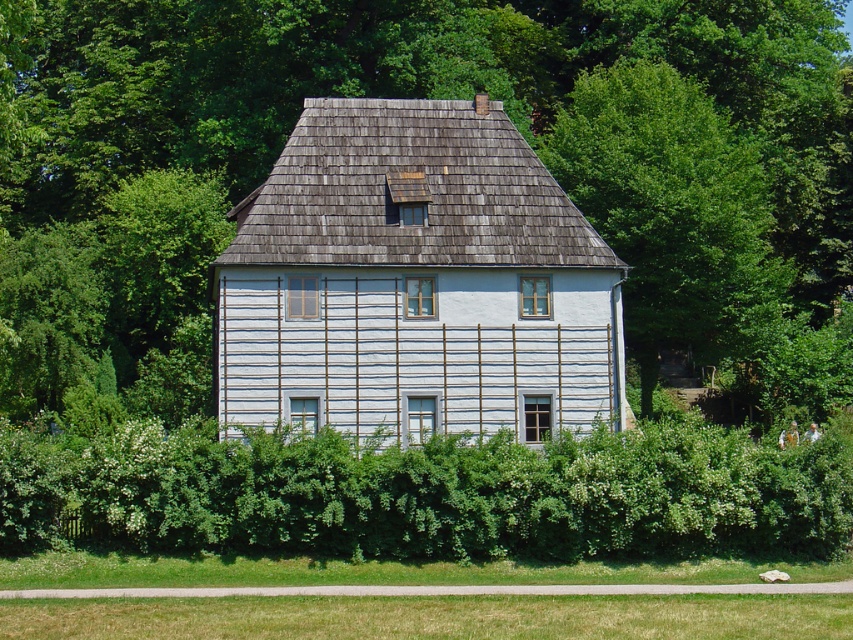
Question: Does green leafy tree at center appear on the right side of green leafy hedge at lower center?

Choices:
 (A) yes
 (B) no

Answer: (B)

Question: Among these objects, which one is farthest from the camera?

Choices:
 (A) green leafy tree at center
 (B) green leafy hedge at lower center

Answer: (B)

Question: Can you confirm if green leafy tree at center is positioned to the right of green leafy hedge at lower center?

Choices:
 (A) no
 (B) yes

Answer: (A)

Question: Among these objects, which one is farthest from the camera?

Choices:
 (A) green leafy tree at center
 (B) green leafy hedge at lower center

Answer: (B)

Question: Is green leafy tree at center wider than green leafy hedge at lower center?

Choices:
 (A) no
 (B) yes

Answer: (B)